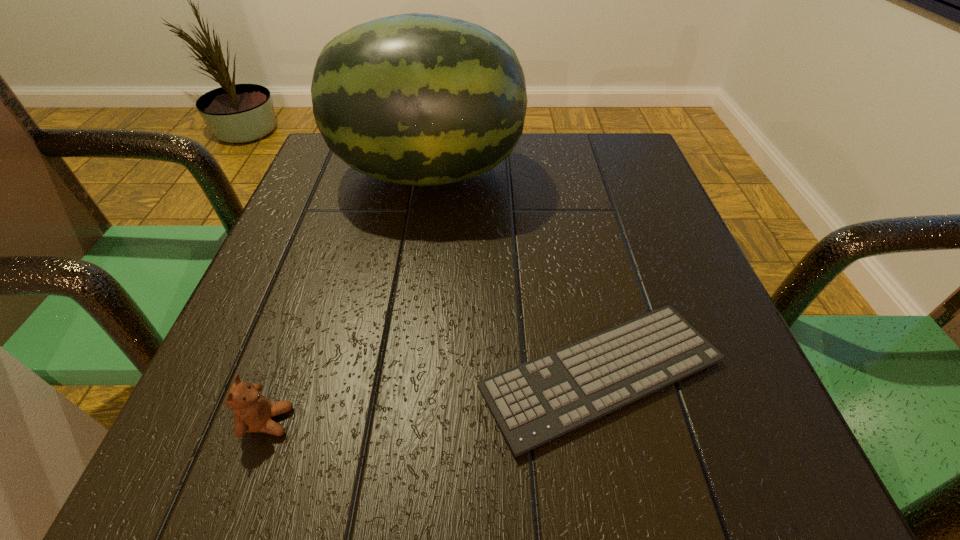
What are the coordinates of `watermelon located at the left edge` in the screenshot? It's located at (417, 99).

Where is `teddy bear that is positioned at the left edge`? teddy bear that is positioned at the left edge is located at coordinates (253, 412).

Where is `object that is positioned at the right edge`? The width and height of the screenshot is (960, 540). object that is positioned at the right edge is located at coordinates (533, 403).

Locate an element on the screen. This screenshot has height=540, width=960. object positioned at the far left corner is located at coordinates (417, 99).

The image size is (960, 540). What are the coordinates of `object that is at the near left corner` in the screenshot? It's located at (253, 412).

In order to click on object at the near right corner in this screenshot , I will do `click(533, 403)`.

In the image, there is a desktop. Where is `free region at the far edge`? free region at the far edge is located at coordinates (534, 136).

Where is `free region at the near edge of the desktop`? The height and width of the screenshot is (540, 960). free region at the near edge of the desktop is located at coordinates (458, 450).

Where is `vacant area at the left edge`? The width and height of the screenshot is (960, 540). vacant area at the left edge is located at coordinates coord(295,204).

You are a GUI agent. You are given a task and a screenshot of the screen. Output one action in this format:
    pyautogui.click(x=<x>, y=<y>)
    Task: Click on the free space at the right edge of the desktop
    This screenshot has width=960, height=540.
    Given the screenshot: What is the action you would take?
    pyautogui.click(x=732, y=390)